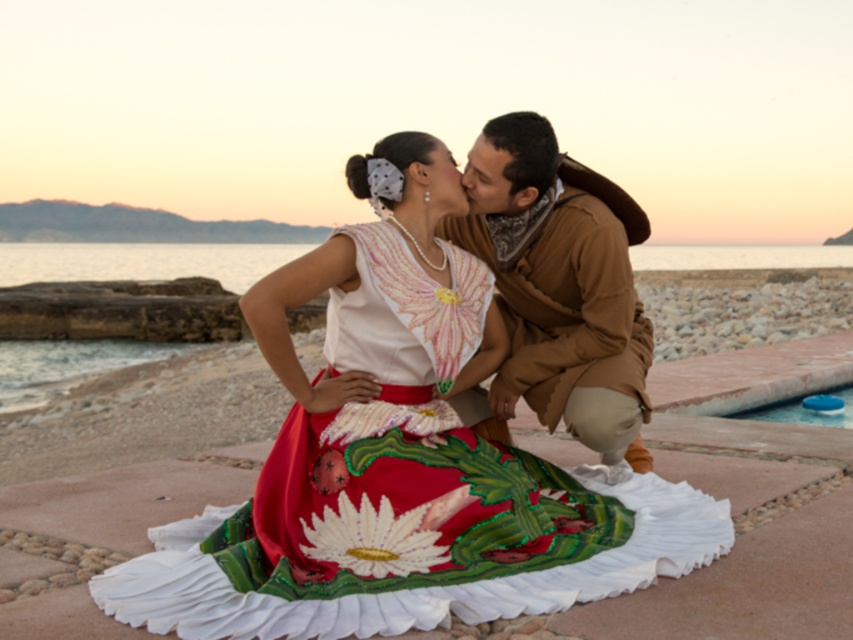
Who is shorter, embroidered silk dress at center or brown suede jacket at center?

embroidered silk dress at center is shorter.

Does embroidered silk dress at center appear on the right side of brown suede jacket at center?

In fact, embroidered silk dress at center is to the left of brown suede jacket at center.

At what (x,y) coordinates should I click in order to perform the action: click on embroidered silk dress at center. Please return your answer as a coordinate pair (x, y). The width and height of the screenshot is (853, 640). Looking at the image, I should click on (405, 497).

Consider the image. Does brown suede jacket at center have a greater width compared to matte brown forehead at upper center?

Yes.

Is brown suede jacket at center positioned in front of matte brown forehead at upper center?

No, it is not.

Is point (494, 385) behind point (476, 156)?

Yes, it is behind point (476, 156).

The width and height of the screenshot is (853, 640). What are the coordinates of `brown suede jacket at center` in the screenshot? It's located at (561, 289).

Is brown suede jacket at center further to camera compared to blue plastic lid at lower right?

No, it is in front of blue plastic lid at lower right.

Does brown suede jacket at center appear over blue plastic lid at lower right?

Yes.

Describe the element at coordinates (561, 289) in the screenshot. I see `brown suede jacket at center` at that location.

What are the coordinates of `brown suede jacket at center` in the screenshot? It's located at coord(561,289).